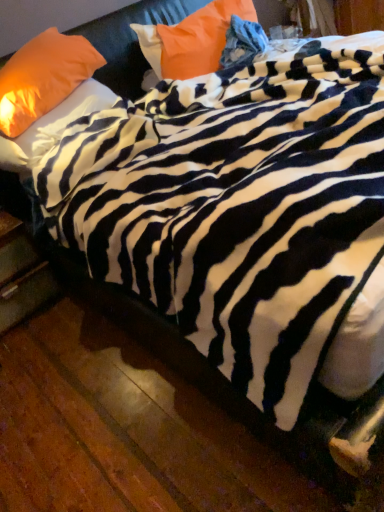
Describe the element at coordinates (21, 274) in the screenshot. I see `wooden drawer at lower left` at that location.

I want to click on wooden drawer at lower left, so click(21, 274).

Identify the location of orange fabric pillow at upper center, positioned as the first pillow in right-to-left order. (191, 40).

What do you see at coordinates (191, 40) in the screenshot? The image size is (384, 512). I see `orange fabric pillow at upper center, marked as the third pillow in a left-to-right arrangement` at bounding box center [191, 40].

I want to click on wooden drawer at lower left, so click(x=21, y=274).

The width and height of the screenshot is (384, 512). Find the location of `pillow that appears behind the matte orange pillow at upper left, marked as the second pillow in a left-to-right arrangement`. pillow that appears behind the matte orange pillow at upper left, marked as the second pillow in a left-to-right arrangement is located at coordinates (191, 40).

From a real-world perspective, relative to matte orange pillow at upper left, marked as the second pillow in a left-to-right arrangement, is orange fabric pillow at upper center, marked as the third pillow in a left-to-right arrangement, vertically above or below?

orange fabric pillow at upper center, marked as the third pillow in a left-to-right arrangement, is situated higher than matte orange pillow at upper left, marked as the second pillow in a left-to-right arrangement, in the real world.

From the picture: Would you consider orange fabric pillow at upper center, positioned as the first pillow in right-to-left order, to be distant from matte orange pillow at upper left, which is the 2th pillow from right to left?

No.

Is orange fabric pillow at upper center, positioned as the first pillow in right-to-left order, shorter than matte orange pillow at upper left, which is the 2th pillow from right to left?

No, orange fabric pillow at upper center, positioned as the first pillow in right-to-left order, is not shorter than matte orange pillow at upper left, which is the 2th pillow from right to left.

From a real-world perspective, is wooden drawer at lower left below orange fabric pillow at upper left, which is counted as the third pillow, starting from the right?

Yes, from a real-world perspective, wooden drawer at lower left is below orange fabric pillow at upper left, which is counted as the third pillow, starting from the right.

Is orange fabric pillow at upper left, which is counted as the third pillow, starting from the right, located within wooden drawer at lower left?

Definitely not — orange fabric pillow at upper left, which is counted as the third pillow, starting from the right, is not inside wooden drawer at lower left.

Is point (34, 254) positioned after point (32, 106)?

Yes, it is behind point (32, 106).

From the image's perspective, is wooden drawer at lower left under orange fabric pillow at upper left, which is counted as the third pillow, starting from the right?

Yes, from the image's perspective, wooden drawer at lower left is below orange fabric pillow at upper left, which is counted as the third pillow, starting from the right.

Is there a large distance between wooden drawer at lower left and matte orange pillow at upper left, marked as the second pillow in a left-to-right arrangement?

No, wooden drawer at lower left is in close proximity to matte orange pillow at upper left, marked as the second pillow in a left-to-right arrangement.

Where is `the 2nd pillow to the right when counting from the wooden drawer at lower left`? The height and width of the screenshot is (512, 384). the 2nd pillow to the right when counting from the wooden drawer at lower left is located at coordinates pyautogui.click(x=53, y=126).

From their relative heights in the image, would you say wooden drawer at lower left is taller or shorter than matte orange pillow at upper left, marked as the second pillow in a left-to-right arrangement?

Clearly, wooden drawer at lower left is taller compared to matte orange pillow at upper left, marked as the second pillow in a left-to-right arrangement.

Does point (12, 281) appear closer or farther from the camera than point (9, 140)?

Point (12, 281).

How distant is wooden drawer at lower left from orange fabric pillow at upper center, marked as the third pillow in a left-to-right arrangement?

wooden drawer at lower left and orange fabric pillow at upper center, marked as the third pillow in a left-to-right arrangement, are 4.29 feet apart.

From the image's perspective, which one is positioned higher, wooden drawer at lower left or orange fabric pillow at upper center, positioned as the first pillow in right-to-left order?

orange fabric pillow at upper center, positioned as the first pillow in right-to-left order, from the image's perspective.

Is wooden drawer at lower left looking in the opposite direction of orange fabric pillow at upper center, marked as the third pillow in a left-to-right arrangement?

wooden drawer at lower left is not turned away from orange fabric pillow at upper center, marked as the third pillow in a left-to-right arrangement.

Which of these two, wooden drawer at lower left or orange fabric pillow at upper center, positioned as the first pillow in right-to-left order, stands taller?

With more height is wooden drawer at lower left.

From a real-world perspective, relative to orange fabric pillow at upper center, positioned as the first pillow in right-to-left order, is orange fabric pillow at upper left, which is counted as the third pillow, starting from the right, vertically above or below?

In terms of real-world spatial position, orange fabric pillow at upper left, which is counted as the third pillow, starting from the right, is above orange fabric pillow at upper center, positioned as the first pillow in right-to-left order.

From the picture: Is orange fabric pillow at upper left, which is counted as the third pillow, starting from the right, placed right next to orange fabric pillow at upper center, marked as the third pillow in a left-to-right arrangement?

No, orange fabric pillow at upper left, which is counted as the third pillow, starting from the right, is not in contact with orange fabric pillow at upper center, marked as the third pillow in a left-to-right arrangement.

In terms of width, does orange fabric pillow at upper left, the 1th pillow viewed from the left, look wider or thinner when compared to orange fabric pillow at upper center, marked as the third pillow in a left-to-right arrangement?

In the image, orange fabric pillow at upper left, the 1th pillow viewed from the left, appears to be wider than orange fabric pillow at upper center, marked as the third pillow in a left-to-right arrangement.

From the picture: From the image's perspective, relative to wooden drawer at lower left, is orange fabric pillow at upper center, positioned as the first pillow in right-to-left order, above or below?

Based on their image positions, orange fabric pillow at upper center, positioned as the first pillow in right-to-left order, is located above wooden drawer at lower left.

Looking at their sizes, would you say orange fabric pillow at upper center, marked as the third pillow in a left-to-right arrangement, is wider or thinner than wooden drawer at lower left?

Clearly, orange fabric pillow at upper center, marked as the third pillow in a left-to-right arrangement, has less width compared to wooden drawer at lower left.

Locate an element on the screen. This screenshot has width=384, height=512. pillow behind the wooden drawer at lower left is located at coordinates (191, 40).

Between orange fabric pillow at upper center, marked as the third pillow in a left-to-right arrangement, and wooden drawer at lower left, which one has smaller size?

orange fabric pillow at upper center, marked as the third pillow in a left-to-right arrangement.

From a real-world perspective, which object stands above the other?

From a 3D spatial view, orange fabric pillow at upper left, the 1th pillow viewed from the left, is above.

Which object is thinner, orange fabric pillow at upper left, the 1th pillow viewed from the left, or matte orange pillow at upper left, marked as the second pillow in a left-to-right arrangement?

With smaller width is orange fabric pillow at upper left, the 1th pillow viewed from the left.

Considering the relative positions of orange fabric pillow at upper left, which is counted as the third pillow, starting from the right, and matte orange pillow at upper left, marked as the second pillow in a left-to-right arrangement, in the image provided, is orange fabric pillow at upper left, which is counted as the third pillow, starting from the right, to the right of matte orange pillow at upper left, marked as the second pillow in a left-to-right arrangement, from the viewer's perspective?

In fact, orange fabric pillow at upper left, which is counted as the third pillow, starting from the right, is to the left of matte orange pillow at upper left, marked as the second pillow in a left-to-right arrangement.

Is orange fabric pillow at upper left, which is counted as the third pillow, starting from the right, placed right next to matte orange pillow at upper left, marked as the second pillow in a left-to-right arrangement?

No, orange fabric pillow at upper left, which is counted as the third pillow, starting from the right, is not next to matte orange pillow at upper left, marked as the second pillow in a left-to-right arrangement.

Where is `pillow that is the 1st object to the left of the orange fabric pillow at upper center, marked as the third pillow in a left-to-right arrangement, starting at the anchor`? pillow that is the 1st object to the left of the orange fabric pillow at upper center, marked as the third pillow in a left-to-right arrangement, starting at the anchor is located at coordinates (53, 126).

Locate an element on the screen. This screenshot has height=512, width=384. the 3rd pillow above the wooden drawer at lower left (from a real-world perspective) is located at coordinates (43, 77).

When comparing their distances from wooden drawer at lower left, does matte orange pillow at upper left, which is the 2th pillow from right to left, or orange fabric pillow at upper left, which is counted as the third pillow, starting from the right, seem further?

orange fabric pillow at upper left, which is counted as the third pillow, starting from the right, is positioned further to the anchor wooden drawer at lower left.

Estimate the real-world distances between objects in this image. Which object is further from matte orange pillow at upper left, marked as the second pillow in a left-to-right arrangement, orange fabric pillow at upper left, which is counted as the third pillow, starting from the right, or orange fabric pillow at upper center, marked as the third pillow in a left-to-right arrangement?

orange fabric pillow at upper center, marked as the third pillow in a left-to-right arrangement, is positioned further to the anchor matte orange pillow at upper left, marked as the second pillow in a left-to-right arrangement.

Considering their positions, is wooden drawer at lower left positioned further to orange fabric pillow at upper center, positioned as the first pillow in right-to-left order, than orange fabric pillow at upper left, which is counted as the third pillow, starting from the right?

The object further to orange fabric pillow at upper center, positioned as the first pillow in right-to-left order, is wooden drawer at lower left.

Which object lies further to the anchor point orange fabric pillow at upper left, which is counted as the third pillow, starting from the right, matte orange pillow at upper left, marked as the second pillow in a left-to-right arrangement, or wooden drawer at lower left?

wooden drawer at lower left is further to orange fabric pillow at upper left, which is counted as the third pillow, starting from the right.

From the image, which object appears to be farther from orange fabric pillow at upper left, the 1th pillow viewed from the left, wooden drawer at lower left or matte orange pillow at upper left, marked as the second pillow in a left-to-right arrangement?

wooden drawer at lower left.

Which object lies further to the anchor point wooden drawer at lower left, orange fabric pillow at upper left, the 1th pillow viewed from the left, or orange fabric pillow at upper center, marked as the third pillow in a left-to-right arrangement?

The object further to wooden drawer at lower left is orange fabric pillow at upper center, marked as the third pillow in a left-to-right arrangement.

Which object lies further to the anchor point wooden drawer at lower left, orange fabric pillow at upper left, the 1th pillow viewed from the left, or matte orange pillow at upper left, marked as the second pillow in a left-to-right arrangement?

orange fabric pillow at upper left, the 1th pillow viewed from the left, is positioned further to the anchor wooden drawer at lower left.

Based on the photo, looking at the image, which one is located further to orange fabric pillow at upper center, positioned as the first pillow in right-to-left order, orange fabric pillow at upper left, the 1th pillow viewed from the left, or wooden drawer at lower left?

wooden drawer at lower left is further to orange fabric pillow at upper center, positioned as the first pillow in right-to-left order.

The image size is (384, 512). I want to click on pillow between orange fabric pillow at upper left, the 1th pillow viewed from the left, and orange fabric pillow at upper center, positioned as the first pillow in right-to-left order, so click(x=53, y=126).

I want to click on pillow between orange fabric pillow at upper left, which is counted as the third pillow, starting from the right, and wooden drawer at lower left vertically, so click(53, 126).